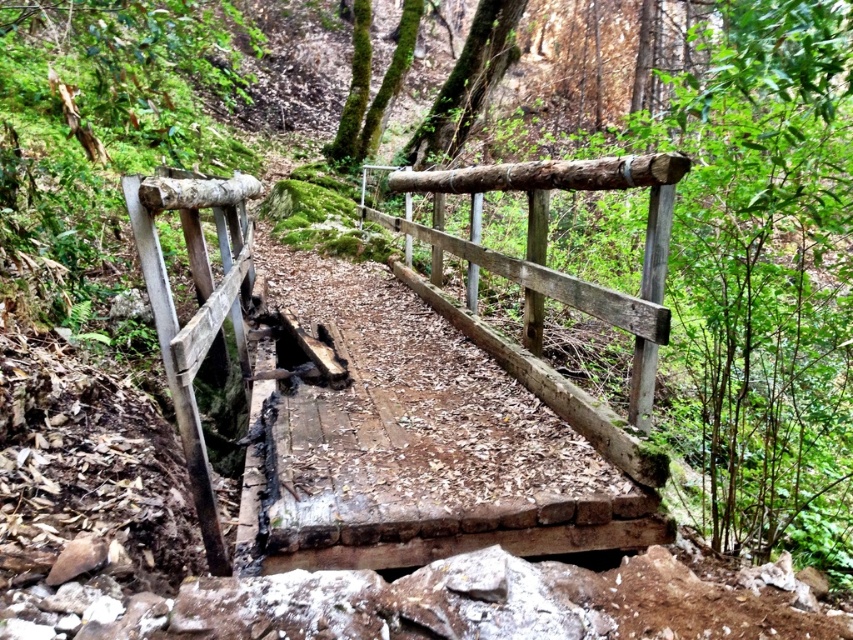
Describe the element at coordinates (440, 440) in the screenshot. Image resolution: width=853 pixels, height=640 pixels. I see `weathered wood bridge at center` at that location.

Between weathered wood bridge at center and natural wood rail at center, which one appears on the left side from the viewer's perspective?

Positioned to the left is weathered wood bridge at center.

Where is `weathered wood bridge at center`? weathered wood bridge at center is located at coordinates (440, 440).